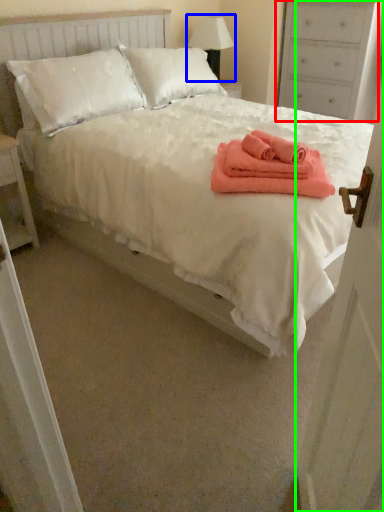
Question: Estimate the real-world distances between objects in this image. Which object is farther from dresser (highlighted by a red box), table lamp (highlighted by a blue box) or door (highlighted by a green box)?

Choices:
 (A) table lamp
 (B) door

Answer: (B)